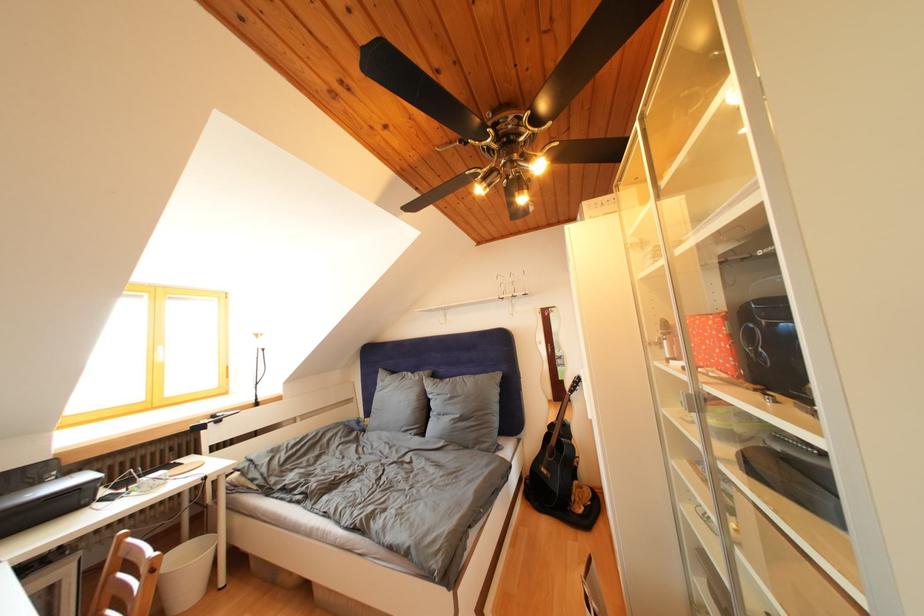
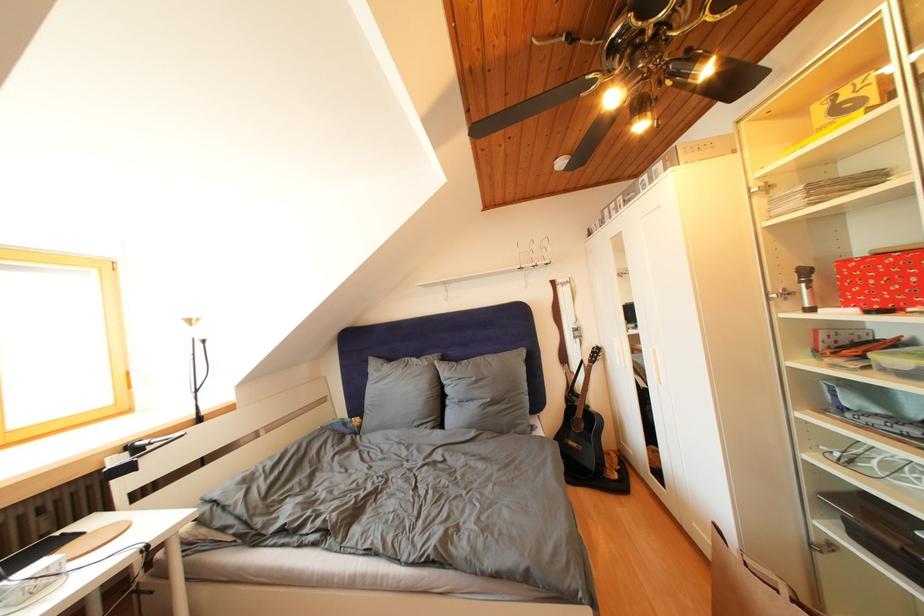
The images are taken continuously from a first-person perspective. In which direction are you moving?

The cameraman moved toward left, forward.